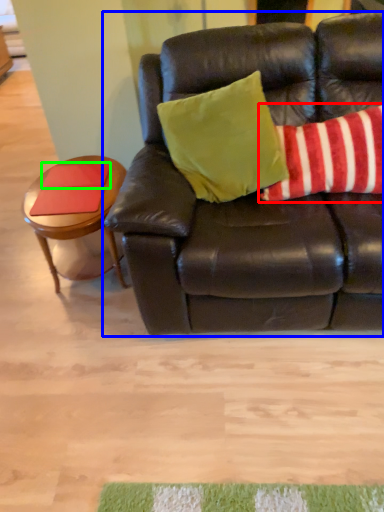
Question: Which object is the farthest from pillow (highlighted by a red box)? Choose among these: studio couch (highlighted by a blue box) or pad (highlighted by a green box).

Choices:
 (A) studio couch
 (B) pad

Answer: (B)